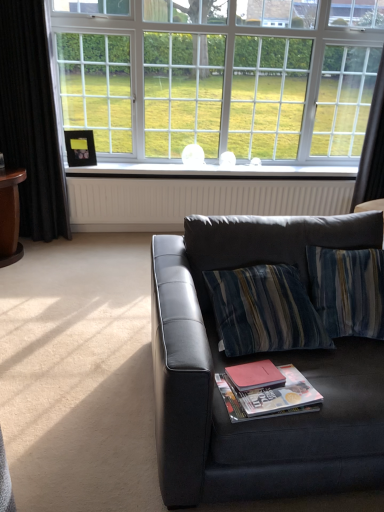
Identify the location of vacant area that is situated to the right of matte red paperback book at center. (301, 382).